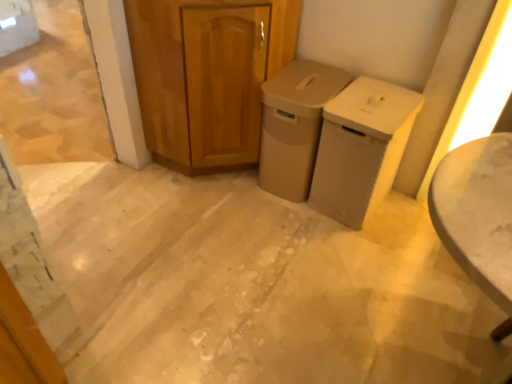
The image size is (512, 384). In order to click on free spot in front of wooden cabinet at center in this screenshot , I will do `click(211, 225)`.